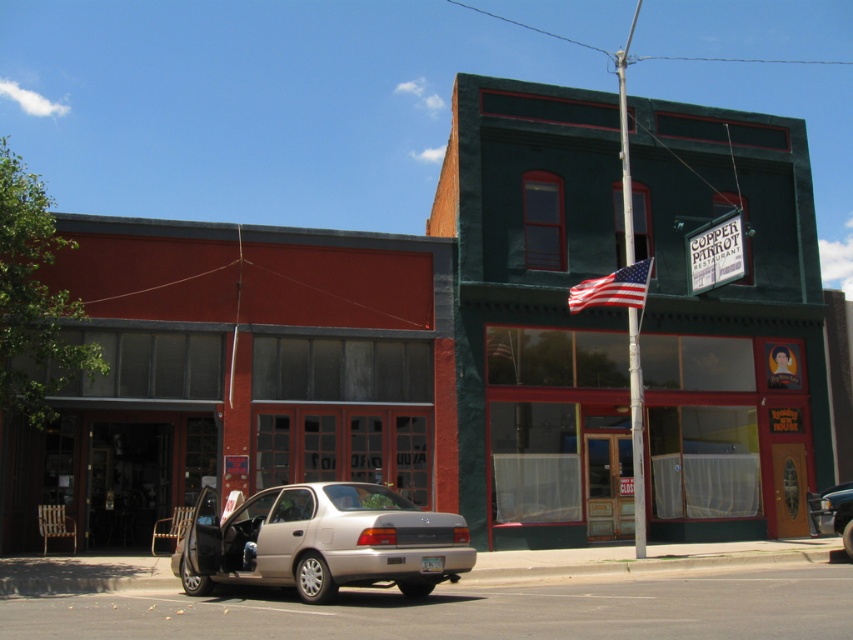
You are a delivery person who needs to park your 1.8 meters tall delivery cart between the matte red building at center and the satin gold sedan at lower left. Can your cart fit vertically between them?

The matte red building at center is taller than the satin gold sedan at lower left. Since the delivery cart is 1.8 meters tall, it can fit vertically between them as the height difference allows enough space.

Looking at this image, you are standing at the origin point of the image coordinate system. You need to locate the matte red building at center. What are its coordinates?

The coordinates of the matte red building at center are at point (x=236, y=372).